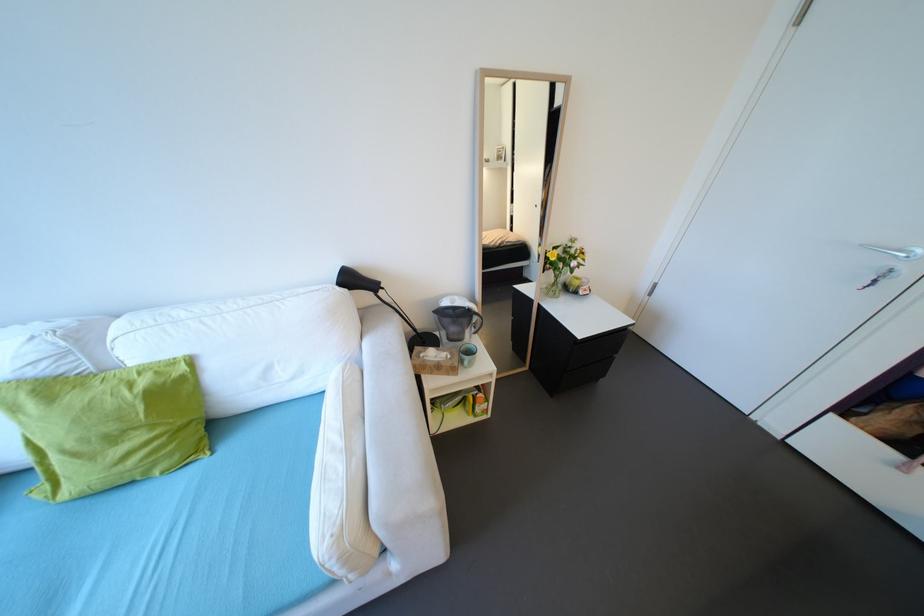
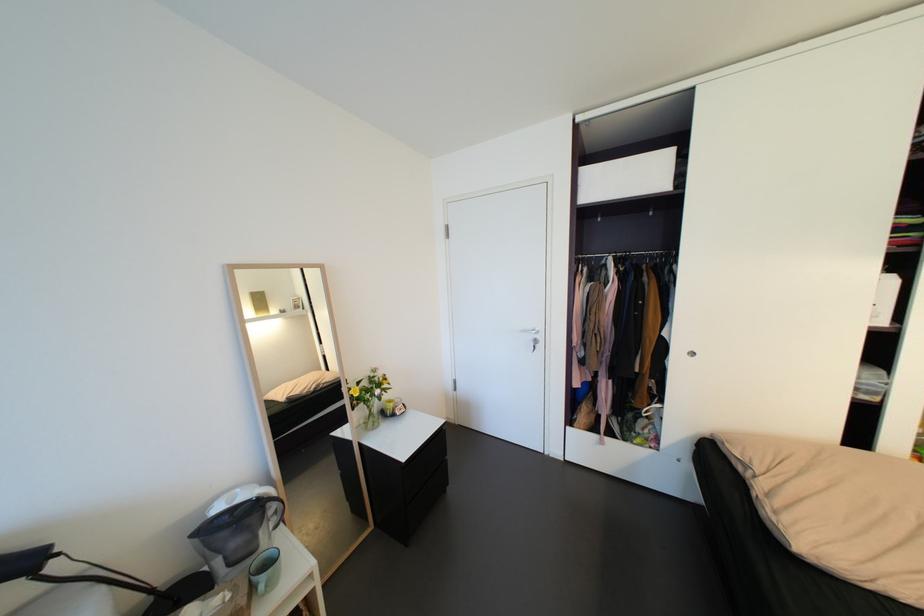
Based on the continuous images, in which direction is the camera rotating?

The camera's rotation is toward right-up.